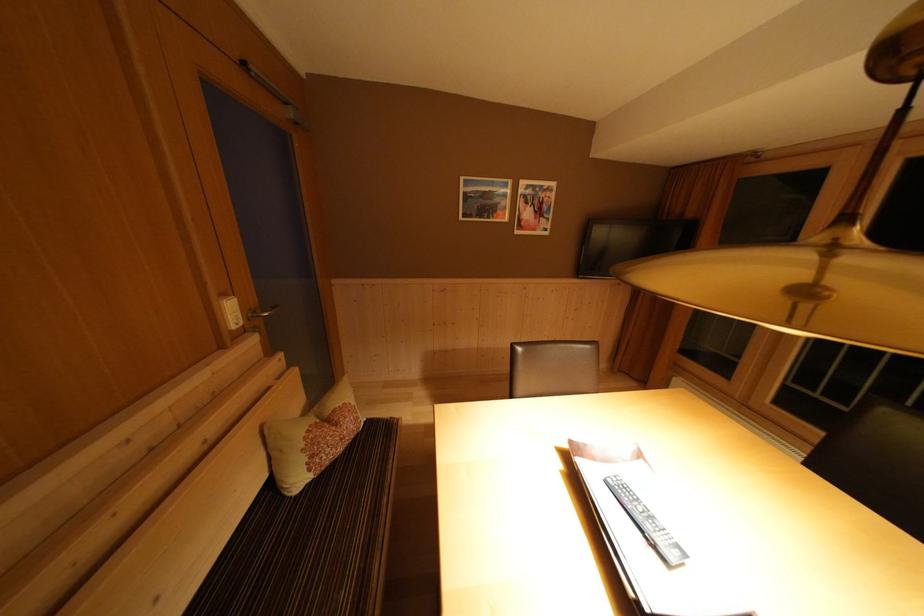
This screenshot has height=616, width=924. Describe the element at coordinates (348, 527) in the screenshot. I see `the bench sitting surface` at that location.